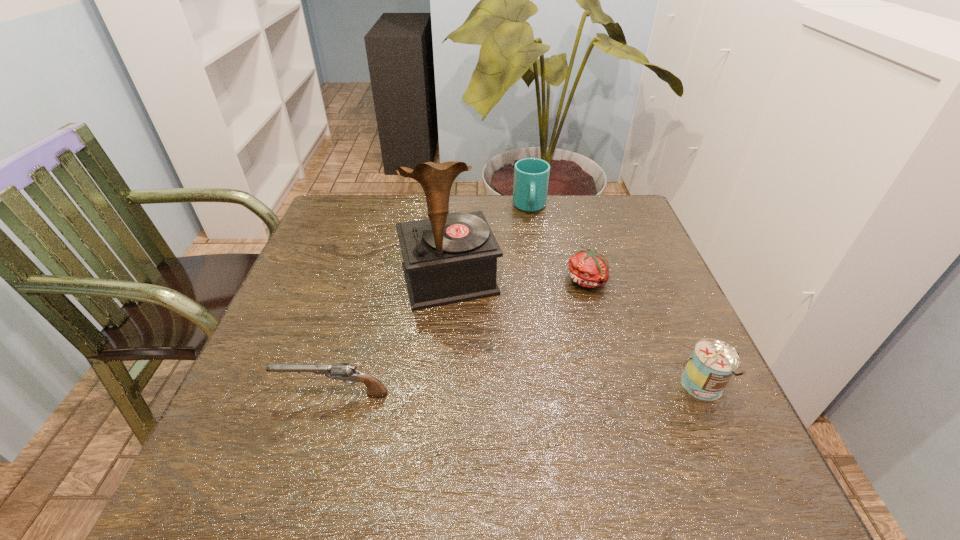
At what (x,y) coordinates should I click in order to perform the action: click on free space between the second object from right to left and the can. Please return your answer as a coordinate pair (x, y). Looking at the image, I should click on (645, 334).

You are a GUI agent. You are given a task and a screenshot of the screen. Output one action in this format:
    pyautogui.click(x=<x>, y=<y>)
    Task: Click on the unoccupied area between the phonograph_record and the fourth object from left to right
    This screenshot has height=540, width=960.
    Given the screenshot: What is the action you would take?
    pyautogui.click(x=519, y=280)

This screenshot has height=540, width=960. I want to click on the second closest object to the cup, so point(588,268).

Identify which object is the second closest to the tomato. Please provide its 2D coordinates. Your answer should be formatted as a tuple, i.e. [(x, y)], where the tuple contains the x and y coordinates of a point satisfying the conditions above.

[(531, 175)]